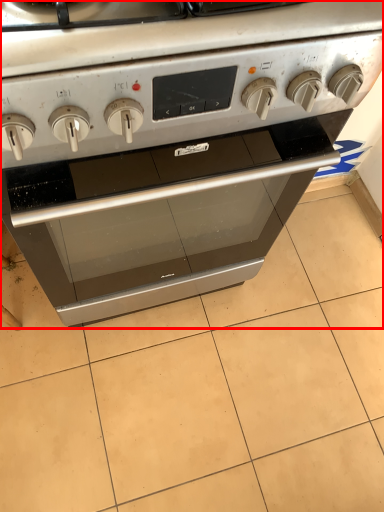
Question: Observing the image, what is the correct spatial positioning of oven (annotated by the red box) in reference to tile?

Choices:
 (A) left
 (B) right

Answer: (A)